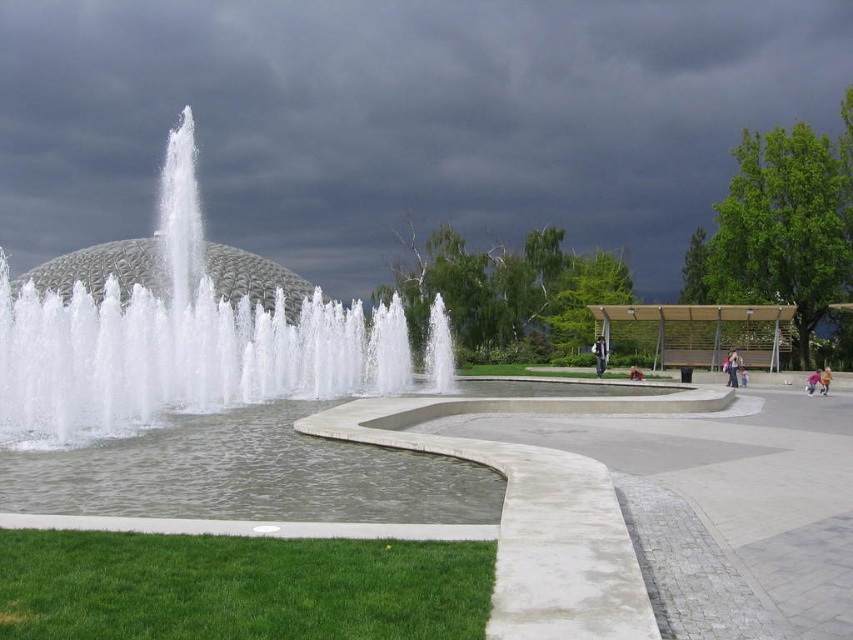
The height and width of the screenshot is (640, 853). What do you see at coordinates (401, 120) in the screenshot? I see `dark gray cloud at upper center` at bounding box center [401, 120].

Who is positioned more to the left, dark gray cloud at upper center or pink fabric person at lower right?

Positioned to the left is dark gray cloud at upper center.

Between point (38, 160) and point (824, 371), which one is positioned behind?

Point (38, 160)

Identify the location of dark gray cloud at upper center. This screenshot has width=853, height=640. (401, 120).

Can you confirm if light brown wooden bench at center is positioned below pink fabric person at lower right?

No, light brown wooden bench at center is not below pink fabric person at lower right.

Does point (604, 339) come behind point (824, 381)?

Yes.

What do you see at coordinates (599, 355) in the screenshot? Image resolution: width=853 pixels, height=640 pixels. I see `light brown wooden bench at center` at bounding box center [599, 355].

This screenshot has width=853, height=640. What are the coordinates of `light brown wooden bench at center` in the screenshot? It's located at (599, 355).

Is the position of dark gray cloud at upper center more distant than that of brown leather jacket at center?

Yes, it is behind brown leather jacket at center.

Between dark gray cloud at upper center and brown leather jacket at center, which one has more height?

With more height is dark gray cloud at upper center.

Where is `dark gray cloud at upper center`? The width and height of the screenshot is (853, 640). dark gray cloud at upper center is located at coordinates (401, 120).

You are a GUI agent. You are given a task and a screenshot of the screen. Output one action in this format:
    pyautogui.click(x=<x>, y=<y>)
    Task: Click on the dark gray cloud at upper center
    The height and width of the screenshot is (640, 853).
    Given the screenshot: What is the action you would take?
    pyautogui.click(x=401, y=120)